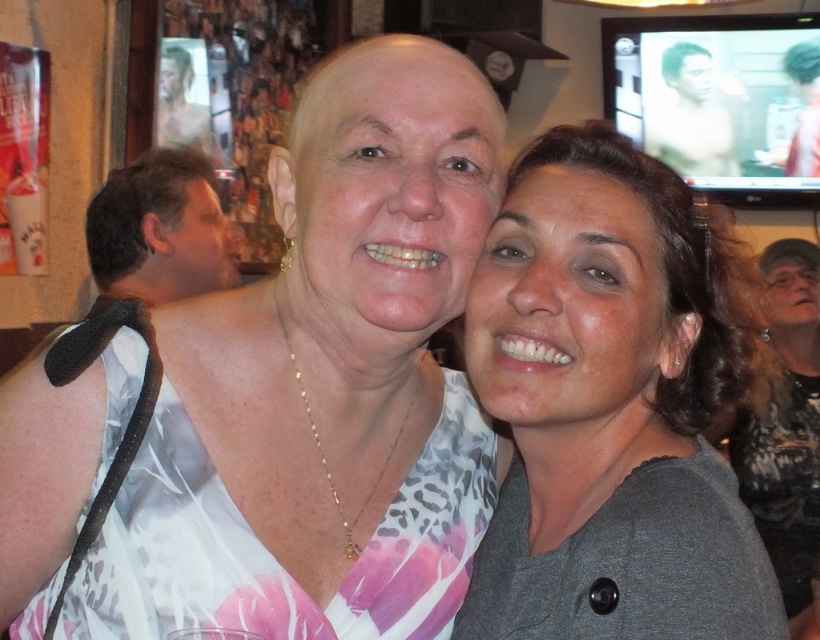
Question: Estimate the real-world distances between objects in this image. Which object is farther from the brown hair at left?

Choices:
 (A) shiny skin man at upper right
 (B) dark brown hair at right

Answer: (A)

Question: Is gray matte shirt at center bigger than shiny skin man at upper right?

Choices:
 (A) yes
 (B) no

Answer: (A)

Question: Which of the following is the farthest from the observer?

Choices:
 (A) (677, 106)
 (B) (187, 74)
 (C) (789, 609)
 (D) (545, 216)

Answer: (A)

Question: Does gray matte shirt at center have a larger size compared to dark brown hair at right?

Choices:
 (A) yes
 (B) no

Answer: (B)

Question: Among these points, which one is nearest to the camera?

Choices:
 (A) (672, 145)
 (B) (121, 262)
 (C) (199, 147)
 (D) (805, 632)

Answer: (B)

Question: Does gray matte shirt at center have a greater width compared to dark brown hair at right?

Choices:
 (A) no
 (B) yes

Answer: (A)